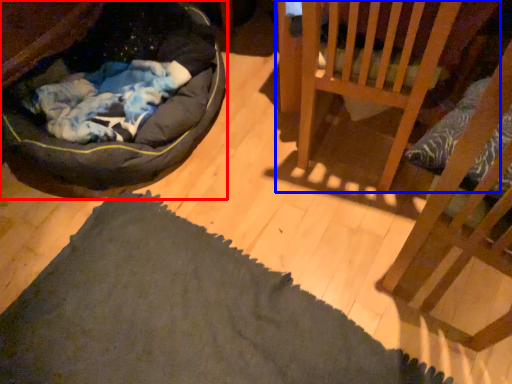
Question: Among these objects, which one is nearest to the camera, dog bed (highlighted by a red box) or furniture (highlighted by a blue box)?

Choices:
 (A) dog bed
 (B) furniture

Answer: (A)